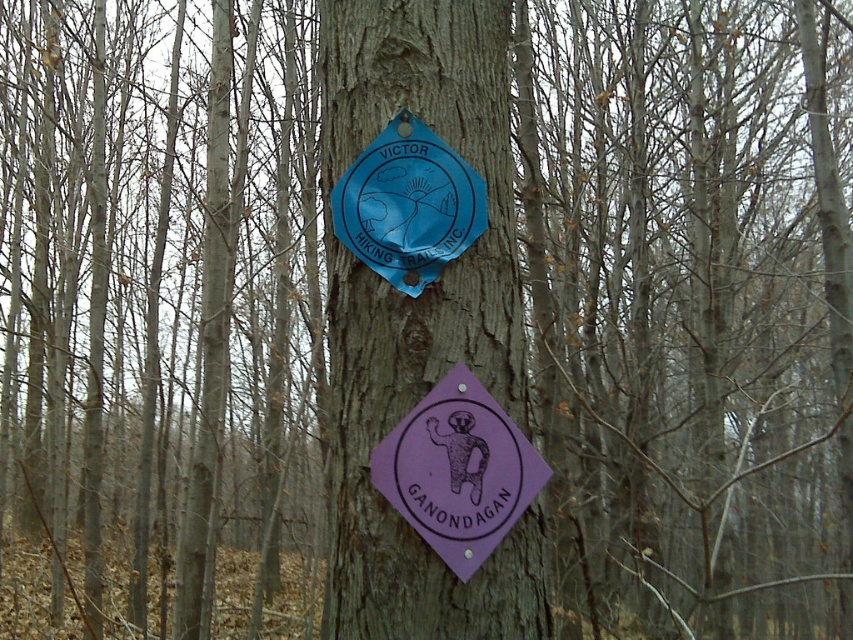
Question: Is purple matte sign at center above blue plastic badge at center?

Choices:
 (A) yes
 (B) no

Answer: (B)

Question: Which of the following is the farthest from the observer?

Choices:
 (A) (392, 208)
 (B) (456, 412)
 (C) (332, 65)

Answer: (C)

Question: Is purple matte sign at center thinner than blue plastic badge at center?

Choices:
 (A) no
 (B) yes

Answer: (A)

Question: Estimate the real-world distances between objects in this image. Which object is closer to the brown rough tree trunk at center?

Choices:
 (A) blue plastic badge at center
 (B) purple matte sign at center

Answer: (A)

Question: Observing the image, what is the correct spatial positioning of brown rough tree trunk at center in reference to blue plastic badge at center?

Choices:
 (A) right
 (B) left

Answer: (A)

Question: Which object is positioned farthest from the brown rough tree trunk at center?

Choices:
 (A) blue plastic badge at center
 (B) purple matte sign at center

Answer: (B)